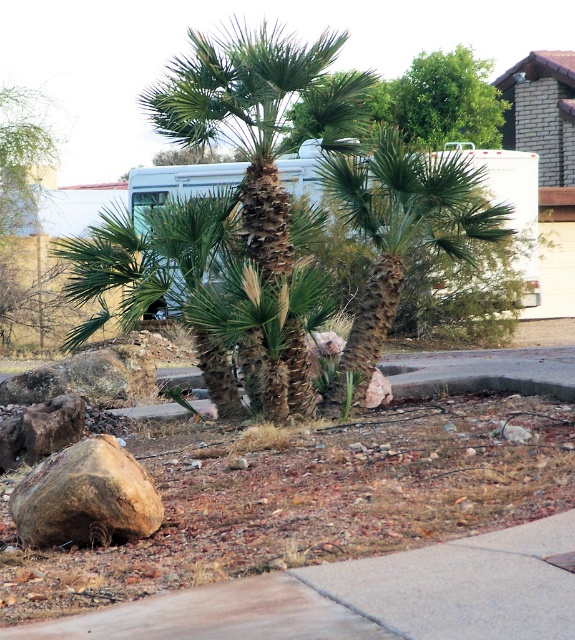
You are standing at the base of the green leafy tree at upper center and want to place a small garden statue on the ground. The statue requires a flat surface that is at least as tall as the tree. Can you place it on the concrete at lower center?

The concrete at lower center is shorter than the green leafy tree at upper center, so placing the statue there would not meet the requirement since the concrete is shorter than the tree.

Based on the photo, you are planning to set up a tent in the arid area shown in the image. You need to choose a spot that is between the green textured palm tree at center and the brown rough boulder at lower left. Considering their sizes, which object should you place your tent closer to if you want more space around your tent?

The green textured palm tree at center has a lesser width compared to the brown rough boulder at lower left. Therefore, placing the tent closer to the green textured palm tree at center would provide more space around the tent since it is narrower than the boulder.

You are standing at the point closest to the RV and want to walk towards the building. Which point, point (478,205) or point (63,460), should you aim for to reach the building first?

You should aim for point (63,460) because it is in front of point (478,205), so it is closer to the building.